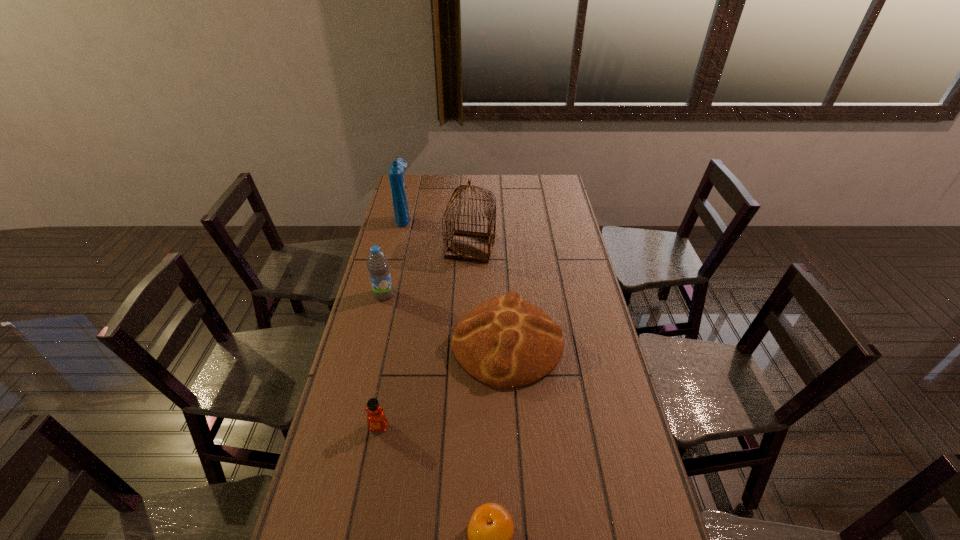
You are a GUI agent. You are given a task and a screenshot of the screen. Output one action in this format:
    pyautogui.click(x=<x>, y=<y>)
    Task: Click on the second farthest object
    The image size is (960, 540).
    Given the screenshot: What is the action you would take?
    465,245

Where is `shampoo`? Image resolution: width=960 pixels, height=540 pixels. shampoo is located at coordinates tap(396, 171).

At what (x,y) coordinates should I click in order to perform the action: click on water bottle. Please return your answer as a coordinate pair (x, y). This screenshot has height=540, width=960. Looking at the image, I should click on (377, 263).

Image resolution: width=960 pixels, height=540 pixels. In order to click on the third farthest object in this screenshot , I will do `click(377, 263)`.

Where is `the third shortest object`? the third shortest object is located at coordinates (504, 342).

This screenshot has width=960, height=540. In order to click on the third nearest object in this screenshot , I will do `click(504, 342)`.

I want to click on the fourth object from right to left, so click(x=376, y=419).

You are a GUI agent. You are given a task and a screenshot of the screen. Output one action in this format:
    pyautogui.click(x=<x>, y=<y>)
    Task: Click on the fifth tallest object
    
    Given the screenshot: What is the action you would take?
    pyautogui.click(x=376, y=419)

Locate an element on the screen. The height and width of the screenshot is (540, 960). vacant space situated 0.070m on the back of the fifth nearest object is located at coordinates (471, 224).

Locate an element on the screen. free space located on the front of the shampoo is located at coordinates (389, 283).